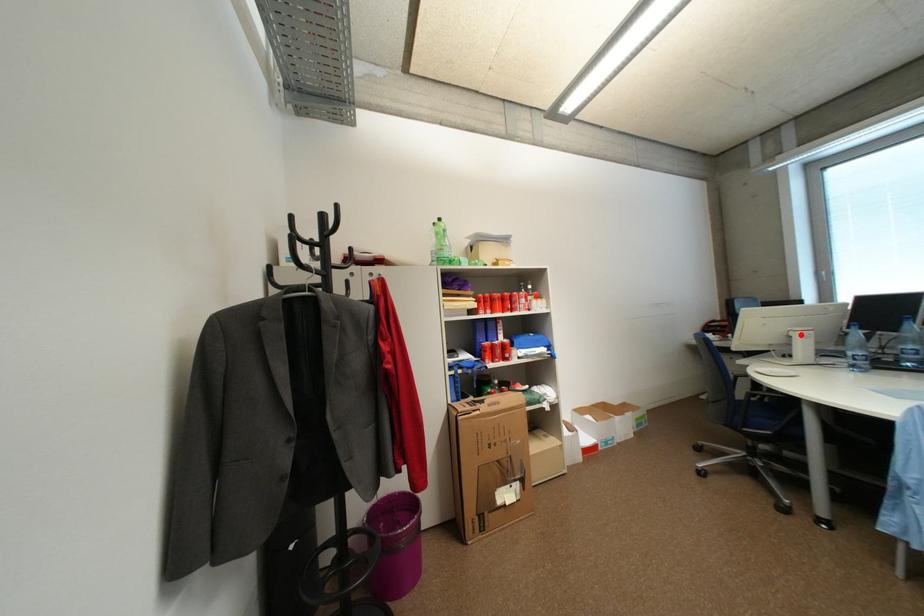
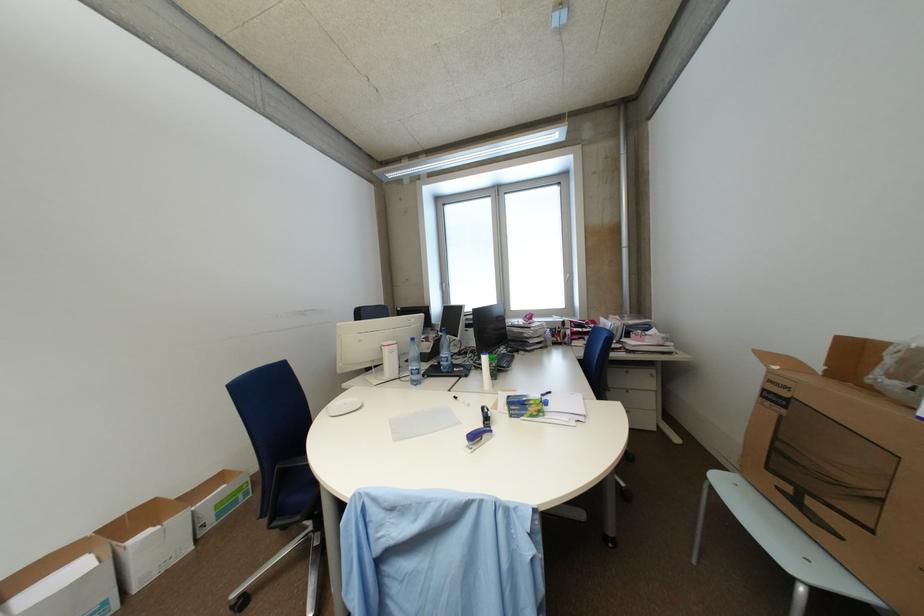
Find the pixel in the second image that matches the highlighted location in the first image.

(392, 350)